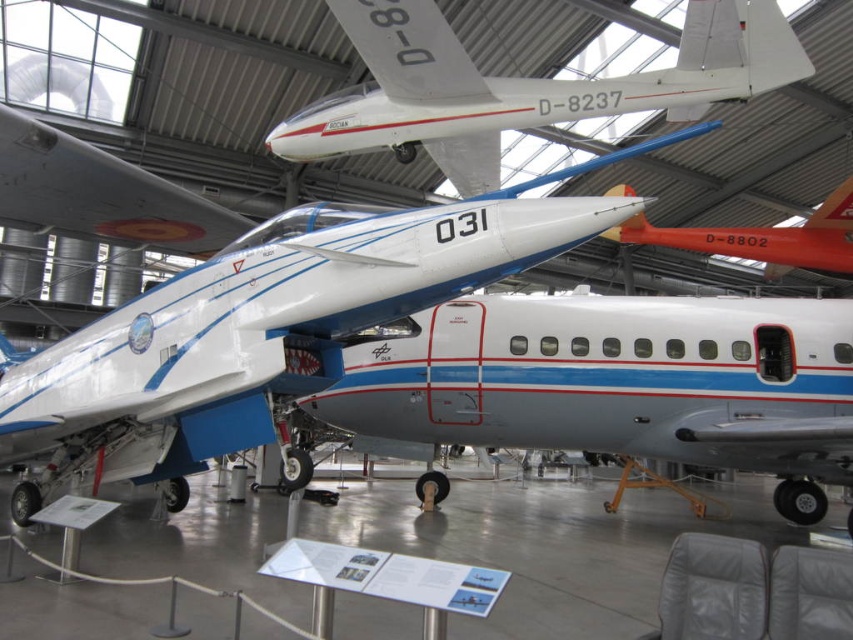
Question: Does white glossy airplane at center have a larger size compared to orange glossy airplane at center?

Choices:
 (A) yes
 (B) no

Answer: (A)

Question: Is white glossy airplane at center smaller than orange glossy airplane at center?

Choices:
 (A) yes
 (B) no

Answer: (B)

Question: Which of these objects is positioned closest to the orange glossy airplane at center?

Choices:
 (A) white glossy airplane at center
 (B) white glossy airplane at upper center

Answer: (B)

Question: Considering the real-world distances, which object is farthest from the white glossy airplane at center?

Choices:
 (A) orange glossy airplane at center
 (B) white glossy airplane at upper center

Answer: (A)

Question: Estimate the real-world distances between objects in this image. Which object is farther from the orange glossy airplane at center?

Choices:
 (A) white glossy airplane at center
 (B) white glossy airplane at upper center

Answer: (A)

Question: Is white glossy airplane at center positioned in front of white glossy airplane at upper center?

Choices:
 (A) no
 (B) yes

Answer: (A)